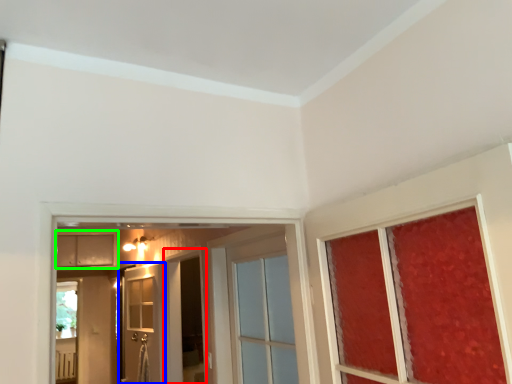
Question: Based on their relative distances, which object is nearer to screen door (highlighted by a red box)? Choose from door (highlighted by a blue box) and cabinetry (highlighted by a green box).

Choices:
 (A) door
 (B) cabinetry

Answer: (A)